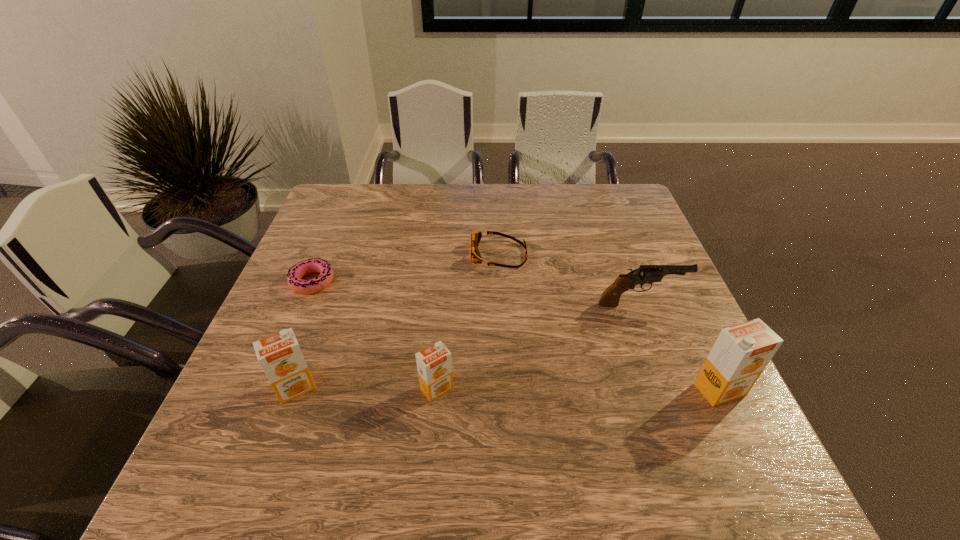
The image size is (960, 540). What are the coordinates of `object positioned at the near left corner` in the screenshot? It's located at (279, 355).

Image resolution: width=960 pixels, height=540 pixels. What are the coordinates of `object that is at the near right corner` in the screenshot? It's located at (740, 354).

At what (x,y) coordinates should I click in order to perform the action: click on free space at the far edge of the desktop. Please return your answer as a coordinate pair (x, y). This screenshot has height=540, width=960. Looking at the image, I should click on (531, 221).

Image resolution: width=960 pixels, height=540 pixels. Identify the location of free space at the near edge. (535, 410).

At what (x,y) coordinates should I click in order to perform the action: click on blank area at the left edge. Please return your answer as a coordinate pair (x, y). This screenshot has width=960, height=540. Looking at the image, I should click on (359, 233).

In the image, there is a desktop. Identify the location of free space at the right edge. (616, 228).

Find the location of a particular element. free space at the far left corner of the desktop is located at coordinates (334, 197).

You are a GUI agent. You are given a task and a screenshot of the screen. Output one action in this format:
    pyautogui.click(x=<x>, y=<y>)
    Task: Click on the vacant space at the near left corner
    The width and height of the screenshot is (960, 540).
    Given the screenshot: What is the action you would take?
    pyautogui.click(x=239, y=417)

In the image, there is a desktop. Where is `vacant space at the far right corner`? vacant space at the far right corner is located at coordinates (627, 189).

Where is `vacant space at the near right corner of the desktop`? The width and height of the screenshot is (960, 540). vacant space at the near right corner of the desktop is located at coordinates (688, 403).